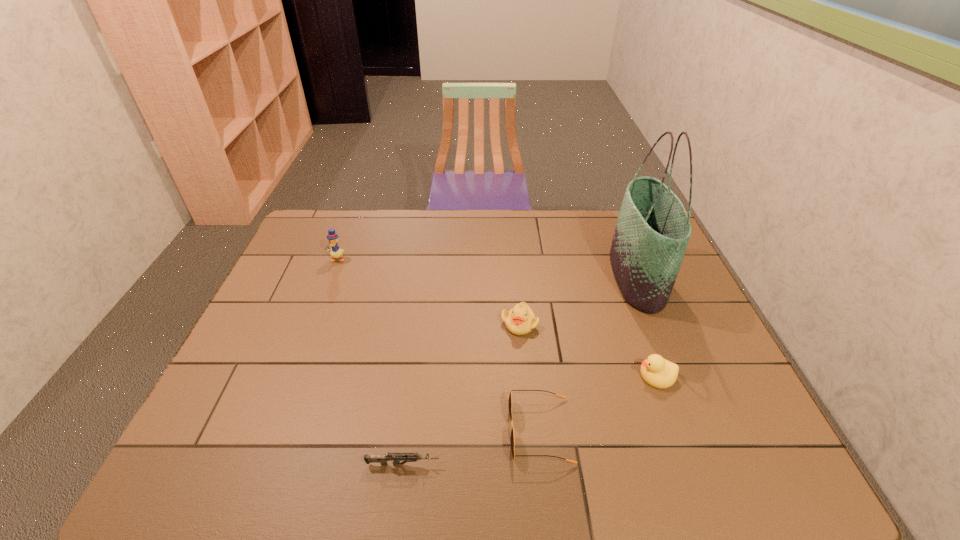
Find the location of a particular element. This screenshot has height=540, width=960. the tallest object is located at coordinates 652,232.

At what (x,y) coordinates should I click in order to perform the action: click on the leftmost duckling. Please return your answer as a coordinate pair (x, y). The width and height of the screenshot is (960, 540). Looking at the image, I should click on (335, 252).

Locate an element on the screen. The height and width of the screenshot is (540, 960). the farthest duckling is located at coordinates (335, 252).

This screenshot has height=540, width=960. I want to click on the second duckling from left to right, so click(x=520, y=320).

In order to click on the fourth farthest object in this screenshot , I will do `click(656, 371)`.

Find the location of `the nearest duckling`. the nearest duckling is located at coordinates (656, 371).

This screenshot has width=960, height=540. Identify the location of the second shortest object. (512, 441).

The image size is (960, 540). Identify the location of the fifth object from right to left. (395, 457).

The image size is (960, 540). Find the location of `gun`. gun is located at coordinates (395, 457).

You are a GUI agent. You are given a task and a screenshot of the screen. Output one action in this format:
    pyautogui.click(x=<x>, y=<y>)
    Task: Click on the vacant space situated 0.240m on the left of the tallest object
    Image resolution: width=960 pixels, height=540 pixels.
    Given the screenshot: What is the action you would take?
    pyautogui.click(x=538, y=278)